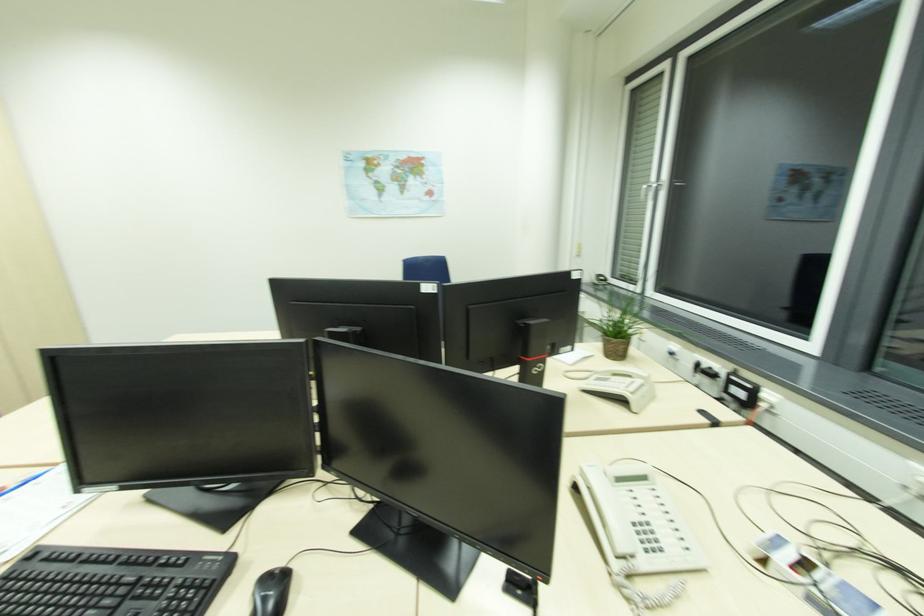
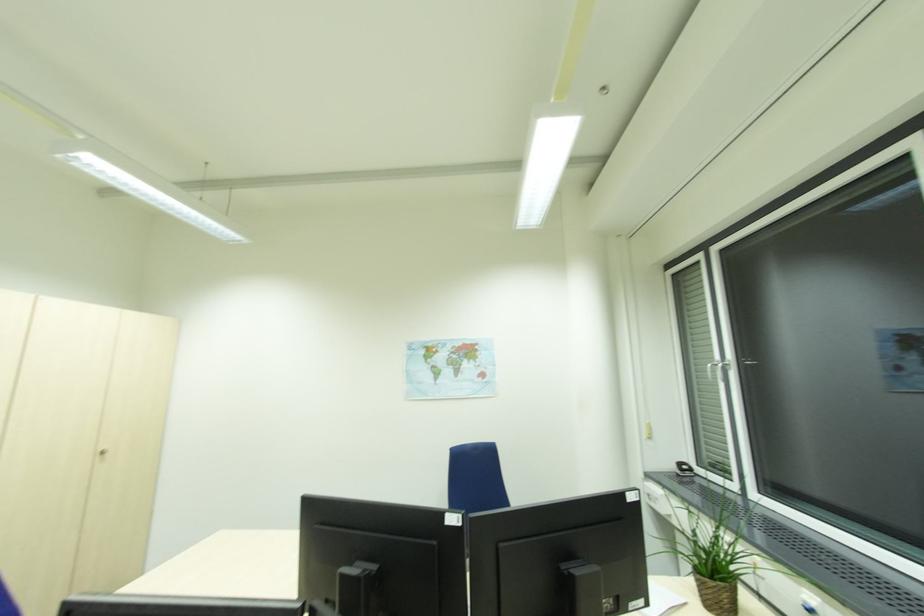
What movement of the cameraman would produce the second image?

The cameraman walked toward right, backward.